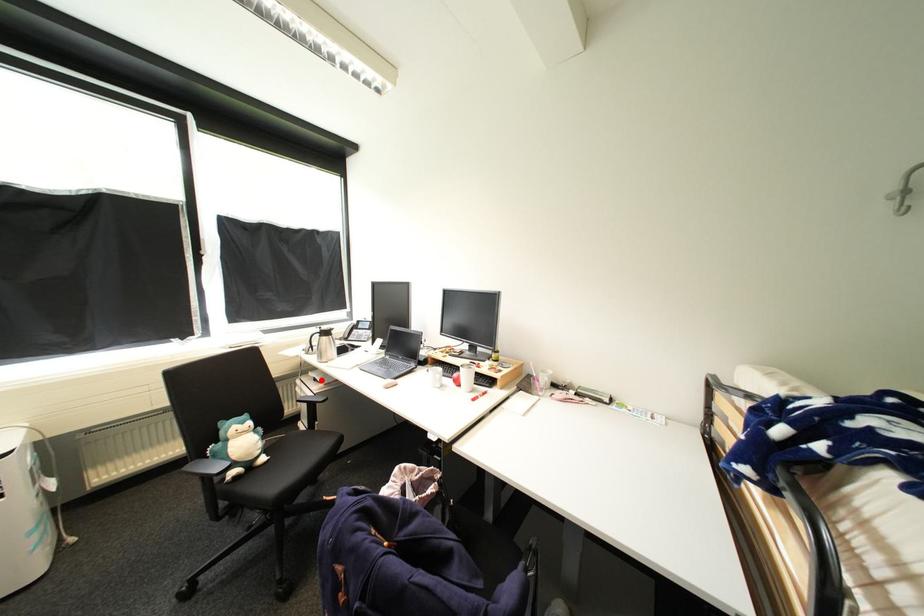
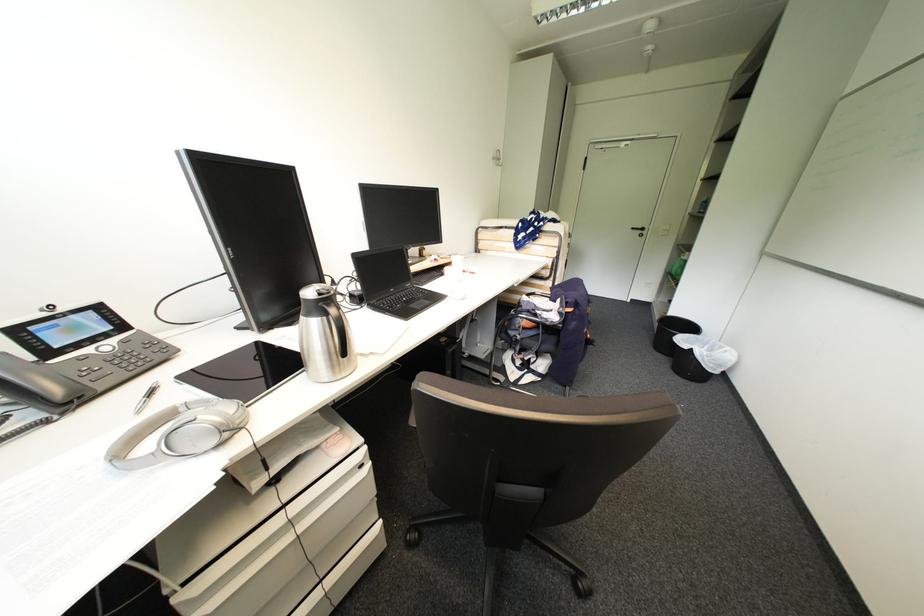
Question: I am providing you with two images of the same scene from different viewpoints. A red point is shown in image1. For the corresponding object point in image2, is it positioned nearer or farther from the camera?

Choices:
 (A) Nearer
 (B) Farther

Answer: (A)